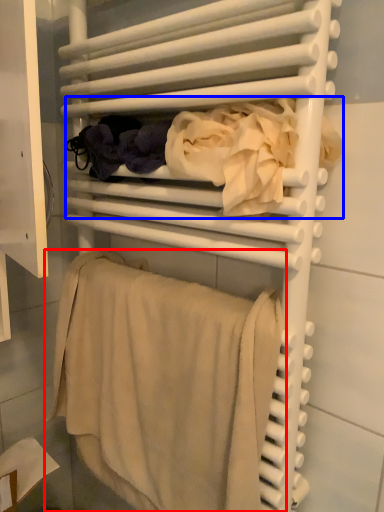
Question: Which object appears farthest to the camera in this image, towel (highlighted by a red box) or clothing (highlighted by a blue box)?

Choices:
 (A) towel
 (B) clothing

Answer: (A)